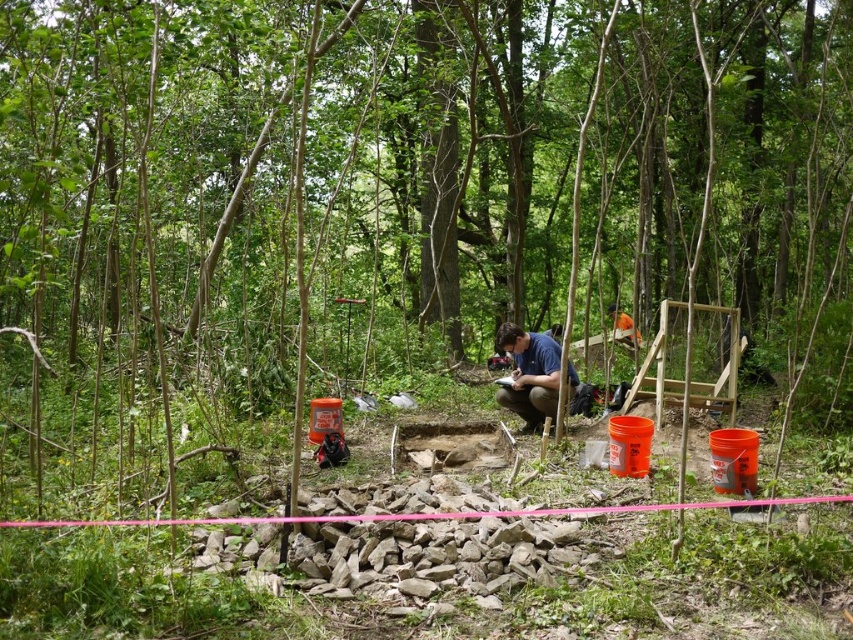
You are an archaeologist working at the excavation site. You need to place a blue fabric squat at center exactly at the coordinates given in the description. What are the coordinates?

The coordinates for the blue fabric squat at center are (531, 374).